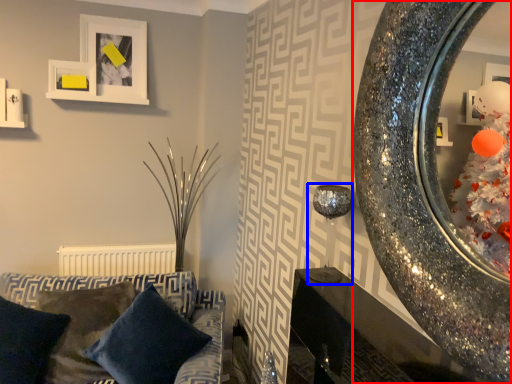
Question: Which point is closer to the camera, mirror (highlighted by a red box) or candle holder (highlighted by a blue box)?

Choices:
 (A) mirror
 (B) candle holder

Answer: (A)